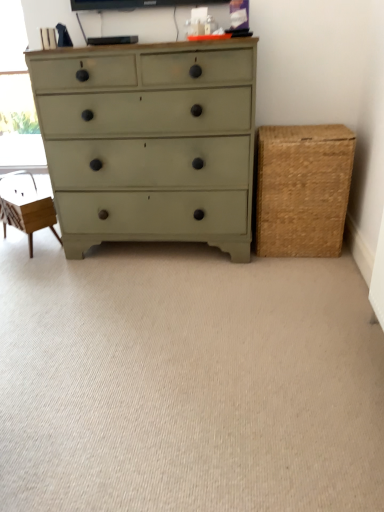
Question: From the image's perspective, relative to braided wicker basket at right, is transparent glass window screen at upper left above or below?

Choices:
 (A) above
 (B) below

Answer: (A)

Question: From a real-world perspective, relative to braided wicker basket at right, is transparent glass window screen at upper left vertically above or below?

Choices:
 (A) below
 (B) above

Answer: (B)

Question: Which object is the farthest from the satin green dresser at center?

Choices:
 (A) wooden swivel chair at left
 (B) beige carpet at center
 (C) transparent glass window screen at upper left
 (D) braided wicker basket at right

Answer: (C)

Question: Estimate the real-world distances between objects in this image. Which object is closer to the wooden swivel chair at left?

Choices:
 (A) braided wicker basket at right
 (B) transparent glass window screen at upper left
 (C) satin green dresser at center
 (D) beige carpet at center

Answer: (C)